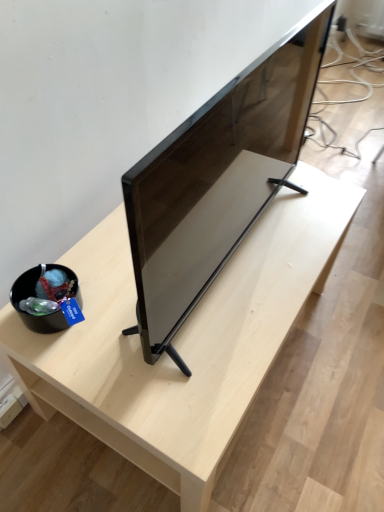
Question: Is light wood table at center shorter than matte black tv at center?

Choices:
 (A) yes
 (B) no

Answer: (A)

Question: Could you tell me if light wood table at center is turned towards matte black tv at center?

Choices:
 (A) yes
 (B) no

Answer: (B)

Question: Can you confirm if light wood table at center is smaller than matte black tv at center?

Choices:
 (A) yes
 (B) no

Answer: (B)

Question: Is light wood table at center outside of matte black tv at center?

Choices:
 (A) no
 (B) yes

Answer: (B)

Question: Is light wood table at center directly adjacent to matte black tv at center?

Choices:
 (A) no
 (B) yes

Answer: (A)

Question: Does light wood table at center have a greater height compared to matte black tv at center?

Choices:
 (A) no
 (B) yes

Answer: (A)

Question: From a real-world perspective, does matte black tv at center stand above light wood table at center?

Choices:
 (A) no
 (B) yes

Answer: (B)

Question: From a real-world perspective, is matte black tv at center physically below light wood table at center?

Choices:
 (A) yes
 (B) no

Answer: (B)

Question: Is matte black tv at center at the right side of light wood table at center?

Choices:
 (A) no
 (B) yes

Answer: (B)

Question: From the image's perspective, is matte black tv at center located above light wood table at center?

Choices:
 (A) yes
 (B) no

Answer: (A)

Question: Does matte black tv at center have a greater height compared to light wood table at center?

Choices:
 (A) yes
 (B) no

Answer: (A)

Question: Can you confirm if matte black tv at center is bigger than light wood table at center?

Choices:
 (A) yes
 (B) no

Answer: (B)

Question: Considering the positions of matte black tv at center and light wood table at center in the image, is matte black tv at center wider or thinner than light wood table at center?

Choices:
 (A) thin
 (B) wide

Answer: (A)